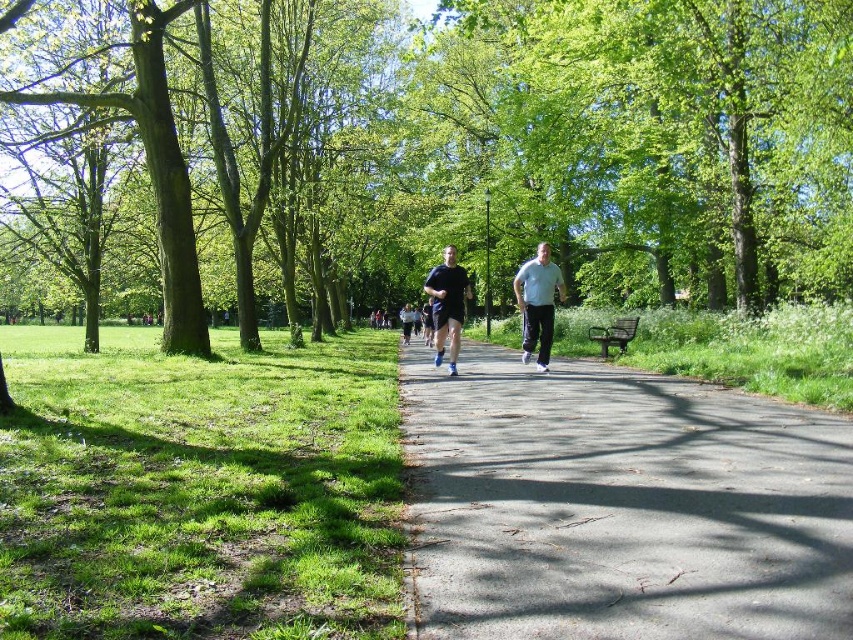
You are standing at the point labeled as point (619, 506), which is on the asphalt path at center. If you walk straight ahead, will you eventually reach the end of the path or continue along it indefinitely?

The asphalt path at center curves gently to the right and stretches into the distance, so walking straight ahead from point (619, 506) will continue along the path indefinitely rather than reaching an immediate end.

You are a hiker who wants to take a photo of the green leafy tree at center and the asphalt path at center. Which object will appear larger in your photo?

The green leafy tree at center will appear larger in the photo because it is taller than the asphalt path at center.

You are planning to walk on the asphalt path at center while wearing your dark blue fabric running shoe at center. Considering their sizes, which one takes up more space in the image?

The asphalt path at center has a larger size compared to the dark blue fabric running shoe at center, so the asphalt path at center takes up more space in the image.